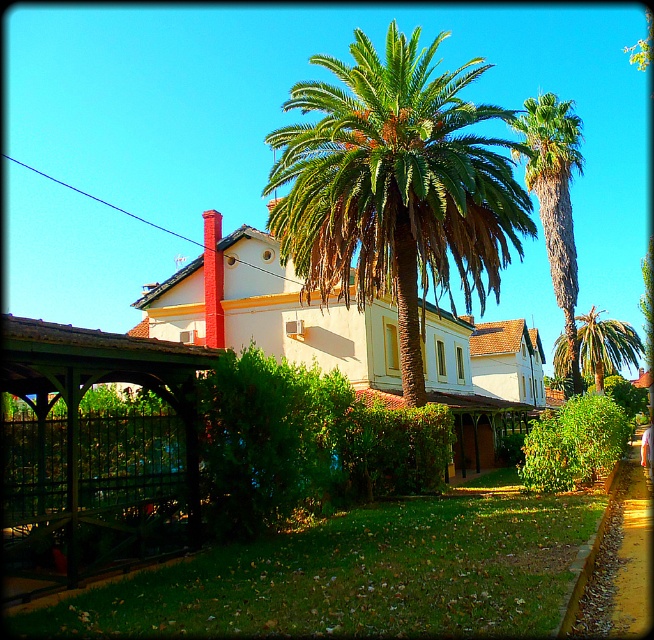
You are standing at the entrance of the traditional building and want to plant a new tree exactly where the green leafy palm at center is currently located. Can you determine the exact coordinates where you should place the new tree?

The green leafy palm at center is located at coordinates point (396,186), so you should place the new tree at those coordinates.

You are standing on the lawn in front of the traditional building. You see two green leafy palms. Which one is closer to you, the green leafy palm at center or the green leafy palm at upper center?

The green leafy palm at center is closer to you because it is smaller in size compared to the green leafy palm at upper center, which suggests it is farther away.